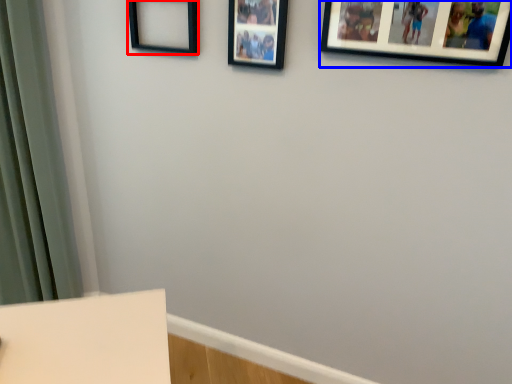
Question: Which of the following is the farthest to the observer, picture frame (highlighted by a red box) or picture frame (highlighted by a blue box)?

Choices:
 (A) picture frame
 (B) picture frame

Answer: (A)